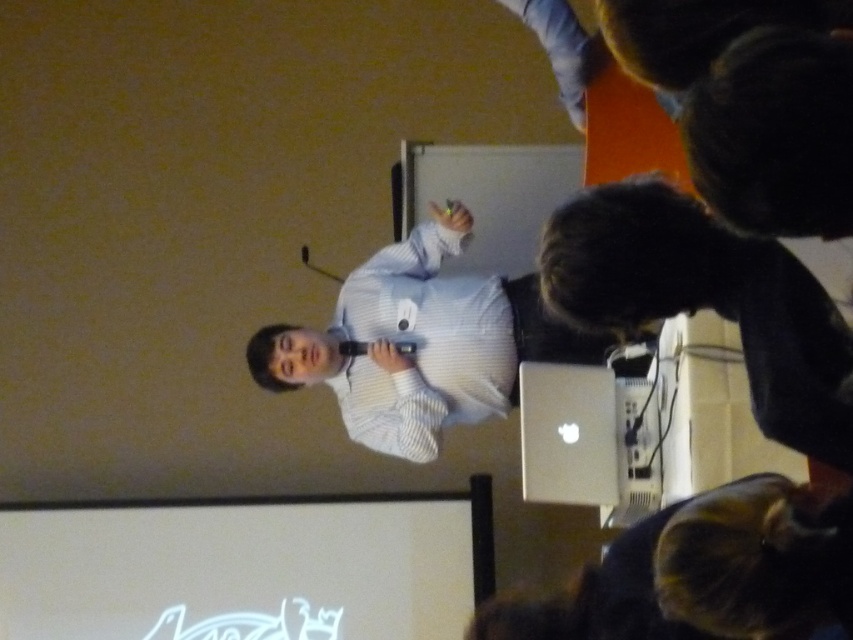
Can you confirm if silver metallic laptop at lower right is bigger than white striped shirt at center?

Actually, silver metallic laptop at lower right might be smaller than white striped shirt at center.

Consider the image. Which of these two, silver metallic laptop at lower right or white striped shirt at center, stands shorter?

Standing shorter between the two is silver metallic laptop at lower right.

Is point (796, 298) farther from viewer compared to point (270, 342)?

No, (796, 298) is in front of (270, 342).

What are the coordinates of `silver metallic laptop at lower right` in the screenshot? It's located at (706, 301).